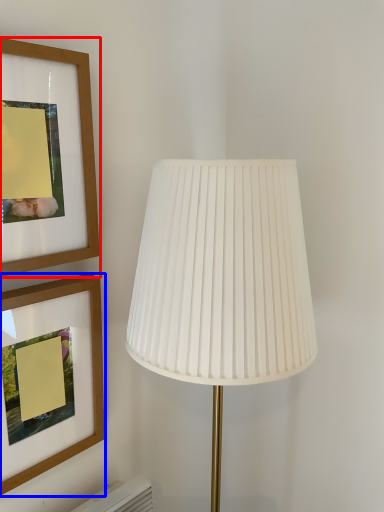
Question: Which point is closer to the camera, picture frame (highlighted by a red box) or picture frame (highlighted by a blue box)?

Choices:
 (A) picture frame
 (B) picture frame

Answer: (A)